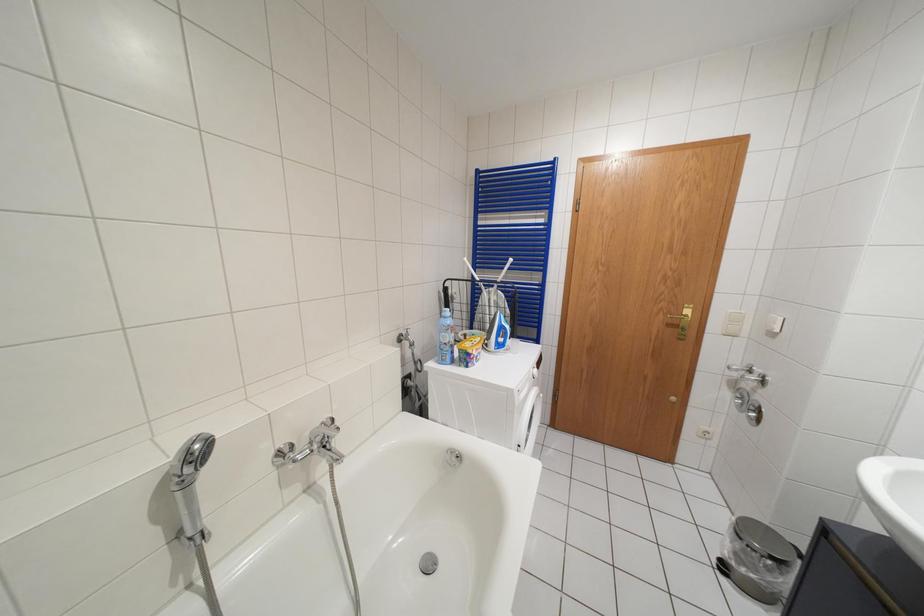
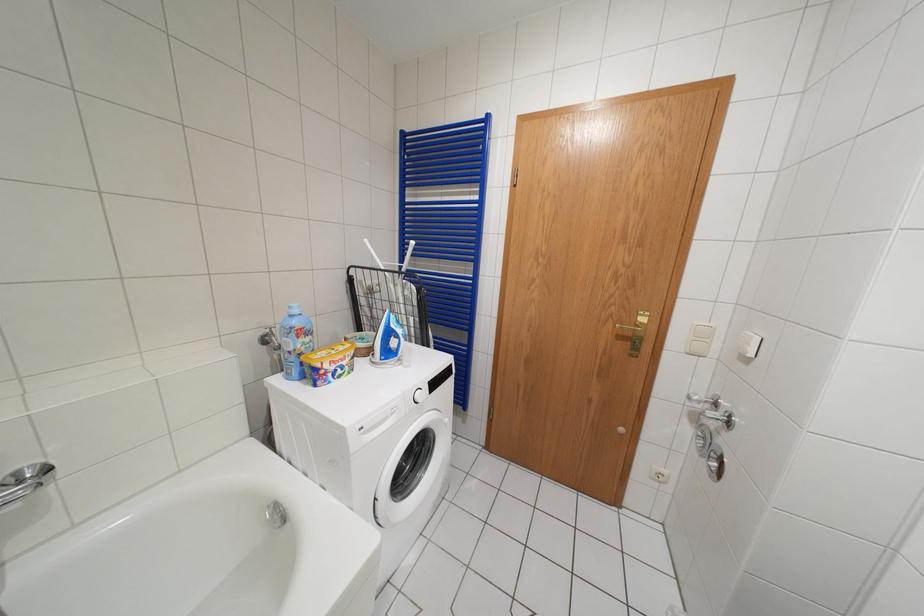
What movement of the cameraman would produce the second image?

The movement direction of the cameraman is right, forward.